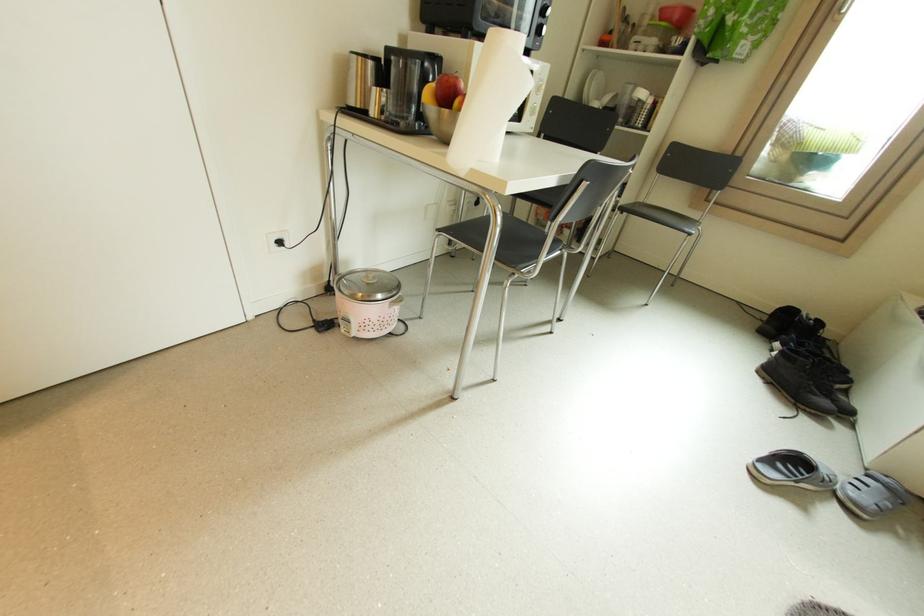
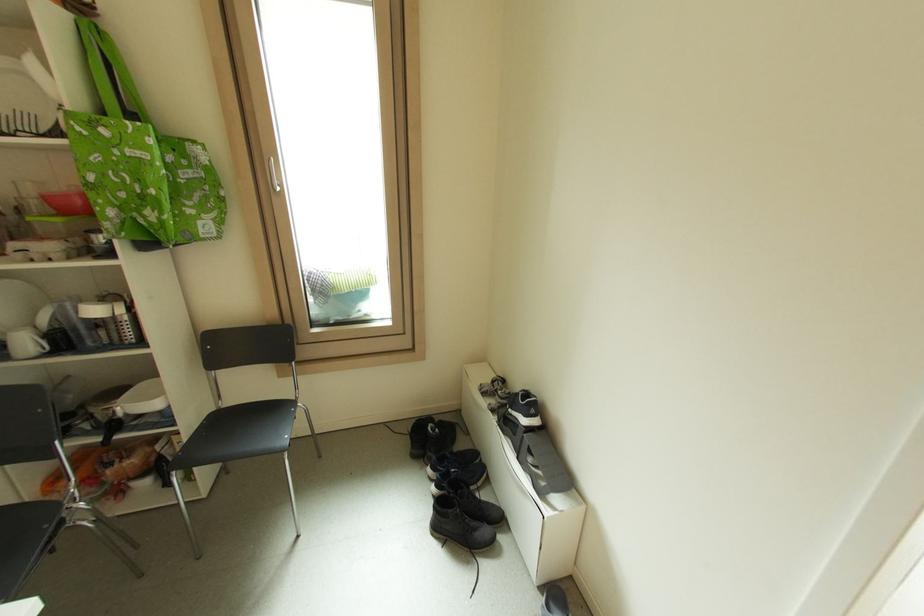
Where in the second image is the point corresponding to the point at 830,403 from the first image?

(490, 532)